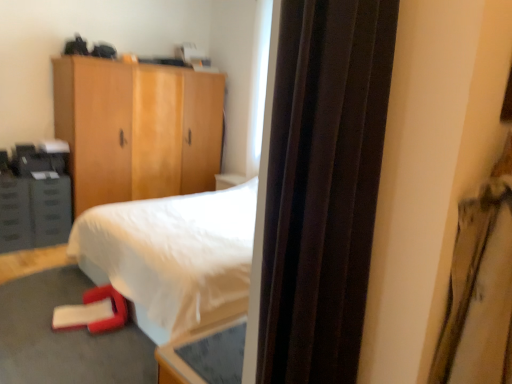
Question: In terms of height, does matte gray cabinet at left look taller or shorter compared to wooden cabinet at upper left?

Choices:
 (A) short
 (B) tall

Answer: (A)

Question: In terms of width, does matte gray cabinet at left look wider or thinner when compared to wooden cabinet at upper left?

Choices:
 (A) wide
 (B) thin

Answer: (B)

Question: Which object is the closest to the satin brown curtain at right?

Choices:
 (A) metallic gray drawer at left
 (B) matte gray cabinet at left
 (C) wooden cabinet at upper left

Answer: (B)

Question: Which is farther from the wooden cabinet at upper left?

Choices:
 (A) metallic gray drawer at left
 (B) satin brown curtain at right
 (C) matte gray cabinet at left

Answer: (B)